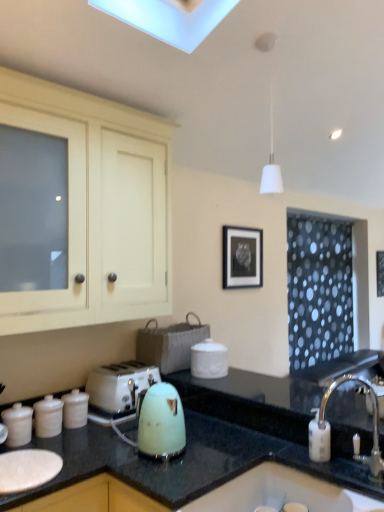
Question: Considering the relative positions of white glossy sink at lower right and white plastic toaster at lower left in the image provided, is white glossy sink at lower right to the right of white plastic toaster at lower left from the viewer's perspective?

Choices:
 (A) no
 (B) yes

Answer: (B)

Question: Can you confirm if white glossy sink at lower right is taller than white plastic toaster at lower left?

Choices:
 (A) yes
 (B) no

Answer: (B)

Question: Is white glossy sink at lower right outside of white plastic toaster at lower left?

Choices:
 (A) yes
 (B) no

Answer: (A)

Question: From the image's perspective, is white glossy sink at lower right located above white plastic toaster at lower left?

Choices:
 (A) yes
 (B) no

Answer: (B)

Question: Would you consider white glossy sink at lower right to be distant from white plastic toaster at lower left?

Choices:
 (A) yes
 (B) no

Answer: (B)

Question: Does point (122, 419) appear closer or farther from the camera than point (236, 494)?

Choices:
 (A) closer
 (B) farther

Answer: (B)

Question: Looking at the image, does mint green plastic kettle at center, the 1th kitchen appliance positioned from the right, seem bigger or smaller compared to white glossy sink at lower right?

Choices:
 (A) big
 (B) small

Answer: (B)

Question: In terms of height, does mint green plastic kettle at center, the 1th kitchen appliance positioned from the right, look taller or shorter compared to white glossy sink at lower right?

Choices:
 (A) short
 (B) tall

Answer: (B)

Question: From the image's perspective, is mint green plastic kettle at center, the 1th kitchen appliance positioned from the right, above or below white glossy sink at lower right?

Choices:
 (A) below
 (B) above

Answer: (B)

Question: Is silver metallic faucet at sink right taller or shorter than white glossy sink at lower right?

Choices:
 (A) tall
 (B) short

Answer: (A)

Question: Looking at the image, does silver metallic faucet at sink right seem bigger or smaller compared to white glossy sink at lower right?

Choices:
 (A) big
 (B) small

Answer: (B)

Question: Is silver metallic faucet at sink right inside the boundaries of white glossy sink at lower right, or outside?

Choices:
 (A) outside
 (B) inside

Answer: (A)

Question: Considering their positions, is silver metallic faucet at sink right located in front of or behind white glossy sink at lower right?

Choices:
 (A) front
 (B) behind

Answer: (B)

Question: Considering their positions, is white glossy canisters at lower left, which is the 2th kitchen appliance in left-to-right order, located in front of or behind matte cream cabinet at upper left?

Choices:
 (A) front
 (B) behind

Answer: (B)

Question: Would you say white glossy canisters at lower left, which is the 2th kitchen appliance in left-to-right order, is inside or outside matte cream cabinet at upper left?

Choices:
 (A) outside
 (B) inside

Answer: (A)